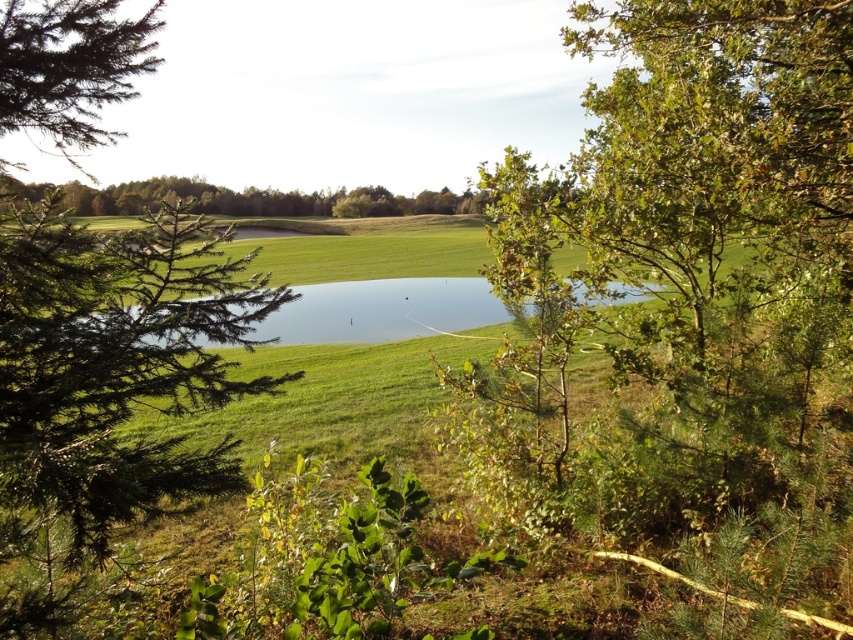
Consider the image. You are standing at the edge of the pond in the middle ground of this serene landscape. You notice two points marked in the scene. Which point, point 1 at coordinates [144,72] or point 2 at coordinates [430,300], is closer to you?

Point 1 at coordinates [144,72] is closer to you than point 2 at coordinates [430,300].